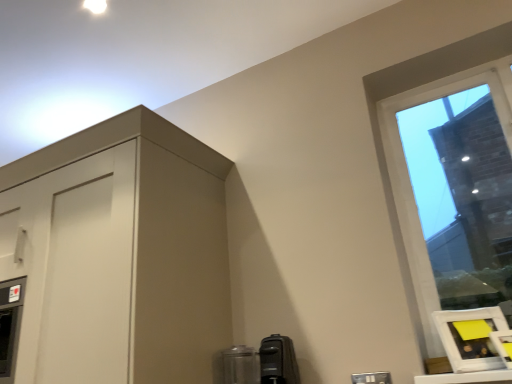
Question: Which direction should I rotate to look at satin black coffee maker at lower center, the 1th appliance positioned from the left, — up or down?

Choices:
 (A) down
 (B) up

Answer: (A)

Question: Considering the relative positions of black plastic coffee maker at lower center, the 1th appliance viewed from the right, and clear glass window at upper right in the image provided, is black plastic coffee maker at lower center, the 1th appliance viewed from the right, to the right of clear glass window at upper right from the viewer's perspective?

Choices:
 (A) yes
 (B) no

Answer: (B)

Question: From the image's perspective, is black plastic coffee maker at lower center, the 1th appliance viewed from the right, on top of clear glass window at upper right?

Choices:
 (A) no
 (B) yes

Answer: (A)

Question: Is black plastic coffee maker at lower center, the 2th appliance viewed from the left, bigger than clear glass window at upper right?

Choices:
 (A) yes
 (B) no

Answer: (B)

Question: Are black plastic coffee maker at lower center, the 1th appliance viewed from the right, and clear glass window at upper right located far from each other?

Choices:
 (A) yes
 (B) no

Answer: (B)

Question: Does black plastic coffee maker at lower center, the 2th appliance viewed from the left, have a lesser width compared to clear glass window at upper right?

Choices:
 (A) no
 (B) yes

Answer: (A)

Question: Is black plastic coffee maker at lower center, the 1th appliance viewed from the right, further to camera compared to clear glass window at upper right?

Choices:
 (A) no
 (B) yes

Answer: (B)

Question: Is black plastic coffee maker at lower center, the 1th appliance viewed from the right, completely or partially inside matte white cabinet at upper left?

Choices:
 (A) yes
 (B) no

Answer: (B)

Question: Considering the relative positions of matte white cabinet at upper left and black plastic coffee maker at lower center, the 1th appliance viewed from the right, in the image provided, is matte white cabinet at upper left to the right of black plastic coffee maker at lower center, the 1th appliance viewed from the right, from the viewer's perspective?

Choices:
 (A) no
 (B) yes

Answer: (A)

Question: Is matte white cabinet at upper left far from black plastic coffee maker at lower center, the 1th appliance viewed from the right?

Choices:
 (A) yes
 (B) no

Answer: (B)

Question: Is matte white cabinet at upper left smaller than black plastic coffee maker at lower center, the 2th appliance viewed from the left?

Choices:
 (A) no
 (B) yes

Answer: (A)

Question: Can you confirm if matte white cabinet at upper left is bigger than black plastic coffee maker at lower center, the 2th appliance viewed from the left?

Choices:
 (A) no
 (B) yes

Answer: (B)

Question: Considering the relative positions of matte white cabinet at upper left and black plastic coffee maker at lower center, the 1th appliance viewed from the right, in the image provided, is matte white cabinet at upper left to the left of black plastic coffee maker at lower center, the 1th appliance viewed from the right, from the viewer's perspective?

Choices:
 (A) yes
 (B) no

Answer: (A)

Question: Is black plastic coffee maker at lower center, the 2th appliance viewed from the left, wider than matte white cabinet at upper left?

Choices:
 (A) no
 (B) yes

Answer: (A)